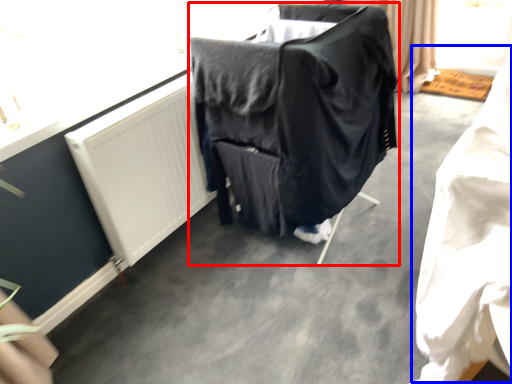
Question: Which point is closer to the camera, furniture (highlighted by a red box) or clothing (highlighted by a blue box)?

Choices:
 (A) furniture
 (B) clothing

Answer: (B)